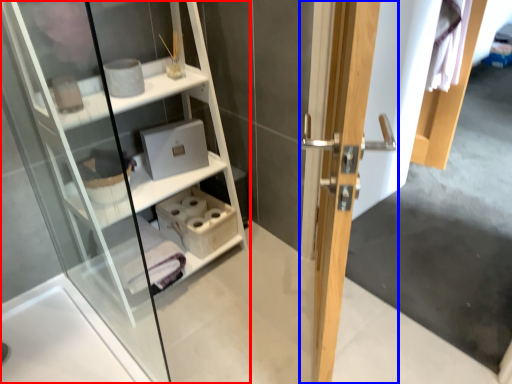
Question: Which object appears closest to the camera in this image, shelf (highlighted by a red box) or door (highlighted by a blue box)?

Choices:
 (A) shelf
 (B) door

Answer: (B)